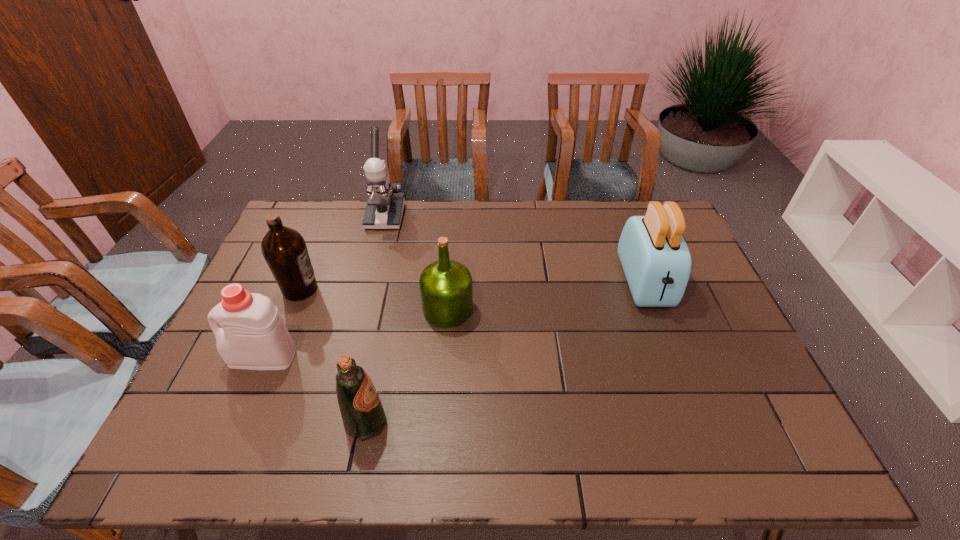
The width and height of the screenshot is (960, 540). Find the location of `object identified as the closest to the nearest object`. object identified as the closest to the nearest object is located at coordinates (253, 336).

Identify which object is the fifth nearest to the microscope. Please provide its 2D coordinates. Your answer should be formatted as a tuple, i.e. [(x, y)], where the tuple contains the x and y coordinates of a point satisfying the conditions above.

[(655, 258)]

Identify which olive oil is the second closest to the leftmost olive oil. Please provide its 2D coordinates. Your answer should be formatted as a tuple, i.e. [(x, y)], where the tuple contains the x and y coordinates of a point satisfying the conditions above.

[(361, 408)]

This screenshot has height=540, width=960. In order to click on olive oil that is the third nearest to the rightmost object in this screenshot , I will do `click(284, 249)`.

I want to click on vacant space that satisfies the following two spatial constraints: 1. on the label of the second object from right to left; 2. on the left side of the leftmost olive oil, so click(x=292, y=308).

Where is `free space that satisfies the following two spatial constraints: 1. on the front side of the second object from right to left; 2. on the handle side of the detergent`? This screenshot has width=960, height=540. free space that satisfies the following two spatial constraints: 1. on the front side of the second object from right to left; 2. on the handle side of the detergent is located at coordinates (444, 357).

The height and width of the screenshot is (540, 960). I want to click on vacant space that satisfies the following two spatial constraints: 1. on the back side of the rightmost olive oil; 2. on the label of the leftmost olive oil, so click(449, 289).

At what (x,y) coordinates should I click in order to perform the action: click on vacant space that satisfies the following two spatial constraints: 1. on the label of the leftmost olive oil; 2. on the right side of the second object from right to left. Please return your answer as a coordinate pair (x, y). This screenshot has height=540, width=960. Looking at the image, I should click on (292, 308).